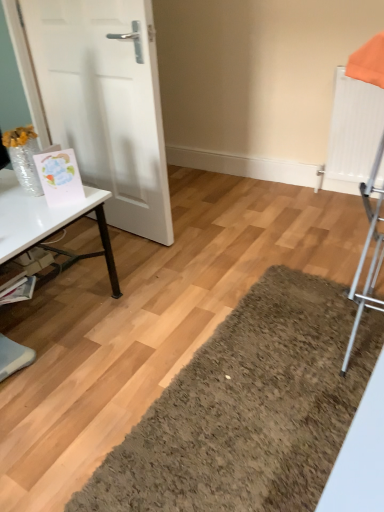
Question: Considering the positions of white glossy table at left and white matte door at left in the image, is white glossy table at left bigger or smaller than white matte door at left?

Choices:
 (A) small
 (B) big

Answer: (B)

Question: Is white glossy table at left wider or thinner than white matte door at left?

Choices:
 (A) thin
 (B) wide

Answer: (B)

Question: From the image's perspective, is white glossy table at left located above or below white matte door at left?

Choices:
 (A) below
 (B) above

Answer: (A)

Question: Choose the correct answer: Is white matte door at left inside white glossy table at left or outside it?

Choices:
 (A) inside
 (B) outside

Answer: (B)

Question: Looking at their shapes, would you say white matte door at left is wider or thinner than white glossy table at left?

Choices:
 (A) thin
 (B) wide

Answer: (A)

Question: Would you say white matte door at left is to the left or to the right of white glossy table at left in the picture?

Choices:
 (A) left
 (B) right

Answer: (B)

Question: Considering the positions of white matte door at left and white glossy table at left in the image, is white matte door at left taller or shorter than white glossy table at left?

Choices:
 (A) short
 (B) tall

Answer: (B)